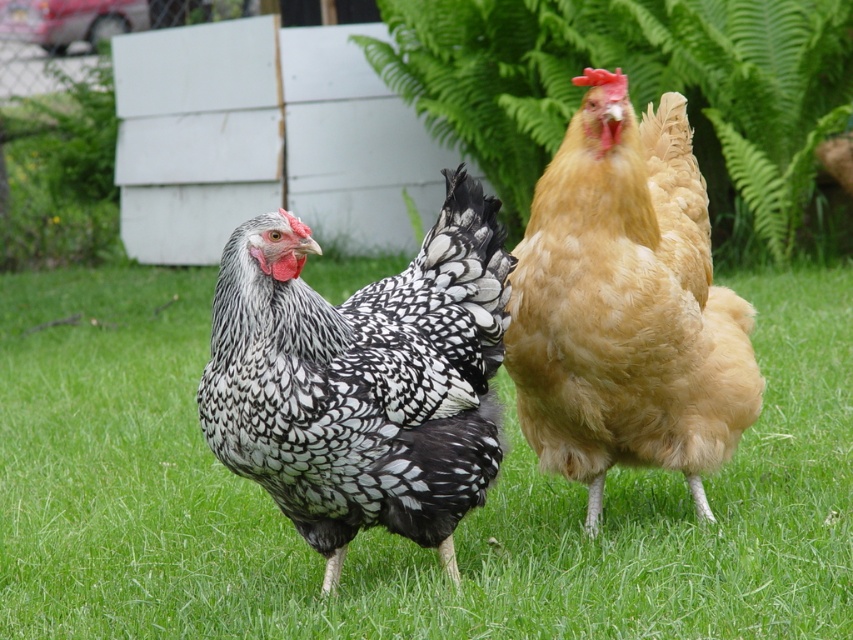
Can you confirm if speckled feathered chicken at center is positioned above golden fluffy chicken at center?

Actually, speckled feathered chicken at center is below golden fluffy chicken at center.

Between point (273, 458) and point (624, 301), which one is positioned in front?

Point (273, 458) is in front.

Find the location of `speckled feathered chicken at center`. speckled feathered chicken at center is located at coordinates pos(363,378).

At what (x,y) coordinates should I click in order to perform the action: click on speckled feathered chicken at center. Please return your answer as a coordinate pair (x, y). Looking at the image, I should click on (363, 378).

Between green grass at center and green leafy fern at upper center, which one is positioned lower?

Positioned lower is green grass at center.

Where is `green grass at center`? green grass at center is located at coordinates (380, 529).

Image resolution: width=853 pixels, height=640 pixels. What are the coordinates of `green grass at center` in the screenshot? It's located at (380, 529).

Is point (105, 452) farther from camera compared to point (665, 452)?

Yes, point (105, 452) is behind point (665, 452).

Which of these two, green grass at center or golden fluffy chicken at center, stands shorter?

With less height is green grass at center.

Identify the location of green grass at center. (380, 529).

In order to click on green grass at center in this screenshot , I will do `click(380, 529)`.